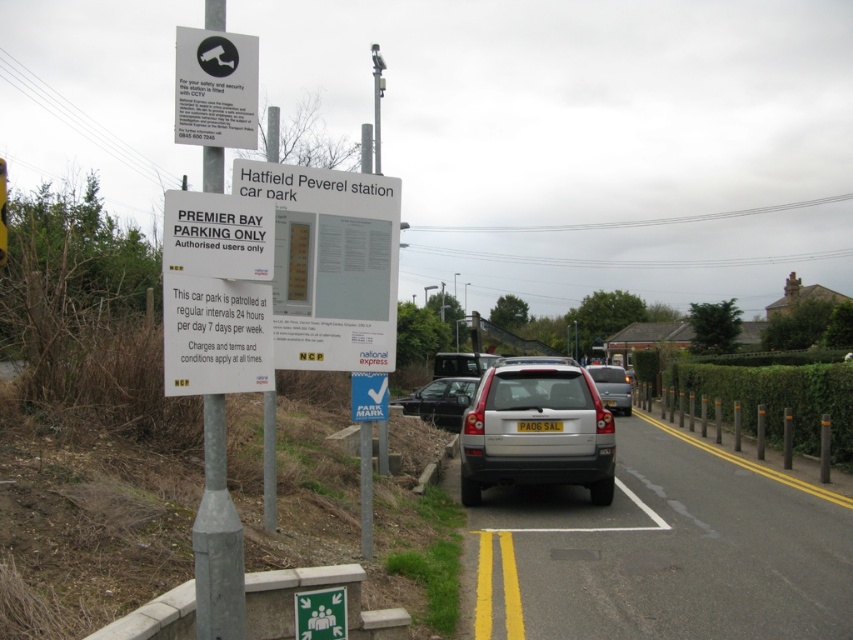
In the scene shown: Is green plastic sign at lower center further to camera compared to silver metallic hatchback at center?

No, green plastic sign at lower center is closer to the viewer.

Can you confirm if green plastic sign at lower center is taller than silver metallic hatchback at center?

In fact, green plastic sign at lower center may be shorter than silver metallic hatchback at center.

Who is more forward, (300, 632) or (619, 380)?

Point (300, 632) is more forward.

Locate an element on the screen. This screenshot has height=640, width=853. green plastic sign at lower center is located at coordinates (320, 612).

Find the location of `silver metallic suv at center`. silver metallic suv at center is located at coordinates (537, 433).

Who is taller, silver metallic suv at center or silver metallic pole at center?

With more height is silver metallic suv at center.

What are the coordinates of `silver metallic suv at center` in the screenshot? It's located at (537, 433).

Identify the location of silver metallic pole at center. Image resolution: width=853 pixels, height=640 pixels. (218, 538).

Locate an element on the screen. silver metallic pole at center is located at coordinates (218, 538).